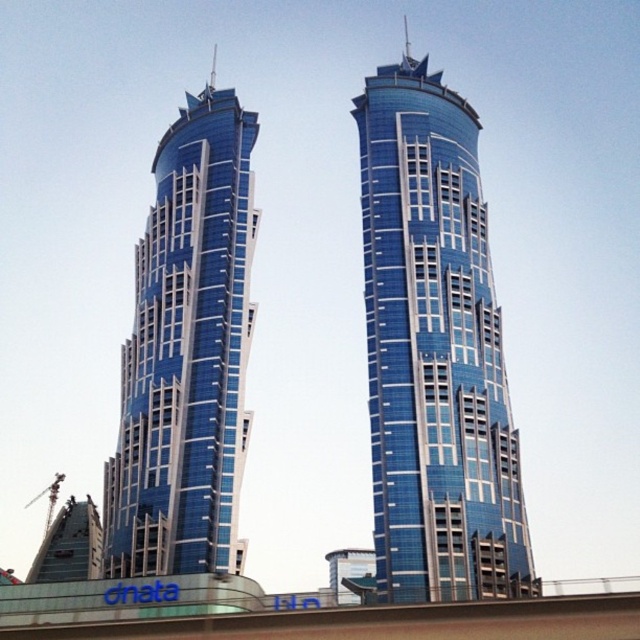
Is point (390, 298) less distant than point (195, 108)?

Yes, point (390, 298) is in front of point (195, 108).

Can you confirm if glossy glass tower at center is positioned to the left of blue glass building at center?

In fact, glossy glass tower at center is to the right of blue glass building at center.

Is point (433, 595) positioned in front of point (186, 166)?

Yes.

You are a GUI agent. You are given a task and a screenshot of the screen. Output one action in this format:
    pyautogui.click(x=<x>, y=<y>)
    Task: Click on the glossy glass tower at center
    This screenshot has height=640, width=640.
    Given the screenshot: What is the action you would take?
    pyautogui.click(x=435, y=352)